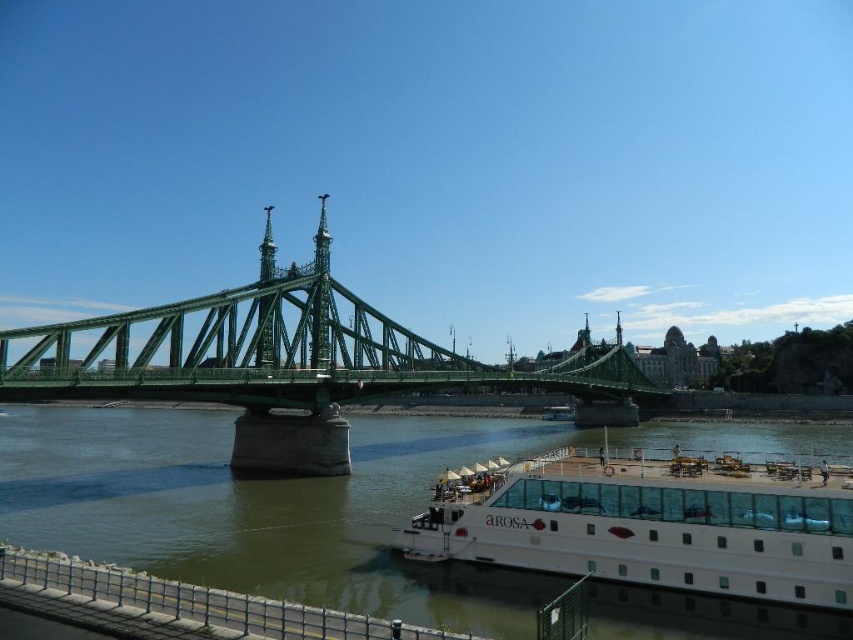
Between green metallic water at lower center and white glassy cruise ship at lower right, which one is positioned lower?

Positioned lower is green metallic water at lower center.

Between green metallic water at lower center and white glassy cruise ship at lower right, which one appears on the left side from the viewer's perspective?

green metallic water at lower center is more to the left.

At what (x,y) coordinates should I click in order to perform the action: click on green metallic water at lower center. Please return your answer as a coordinate pair (x, y). The image size is (853, 640). Looking at the image, I should click on [265, 508].

Find the location of a particular element. The height and width of the screenshot is (640, 853). green metallic water at lower center is located at coordinates coord(265,508).

Does point (129, 493) come behind point (604, 392)?

No, (129, 493) is closer to viewer.

This screenshot has width=853, height=640. I want to click on green metallic water at lower center, so click(265, 508).

Who is shorter, green metallic bridge at center or white glassy cruise ship at lower right?

With less height is white glassy cruise ship at lower right.

Is point (287, 422) closer to camera compared to point (778, 488)?

No, it is not.

What are the coordinates of `green metallic bridge at center` in the screenshot? It's located at (292, 364).